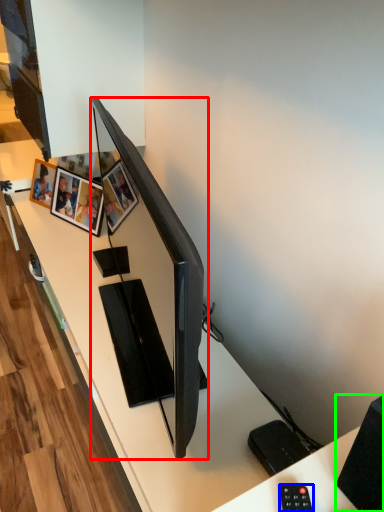
Question: Considering the real-world distances, which object is closest to television (highlighted by a red box)? control (highlighted by a blue box) or speaker (highlighted by a green box).

Choices:
 (A) control
 (B) speaker

Answer: (B)